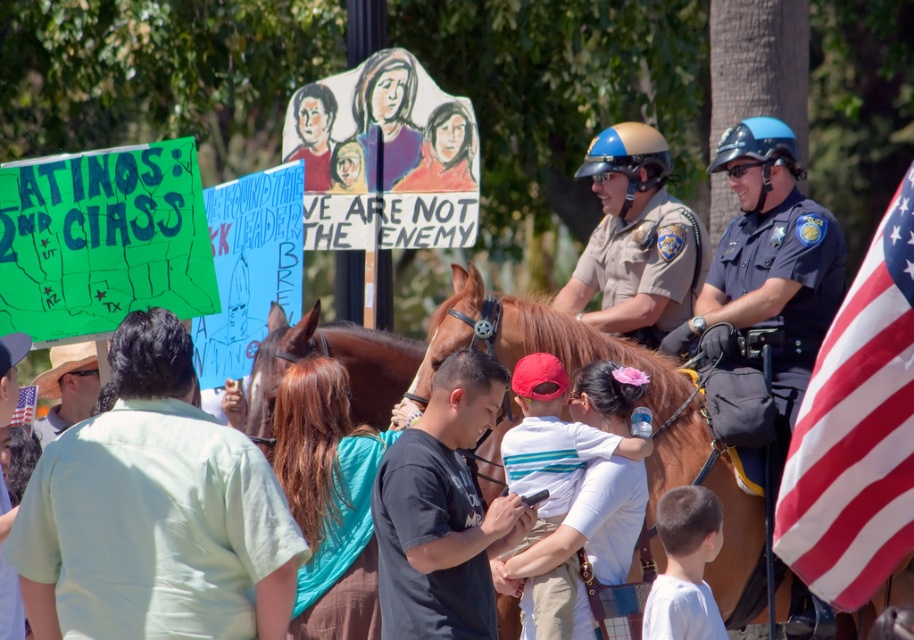
Question: Does light green fabric shirt at center-left lie behind shiny blue helmet at center?

Choices:
 (A) no
 (B) yes

Answer: (A)

Question: Does shiny blue helmet at center appear under brown glossy horse at center?

Choices:
 (A) no
 (B) yes

Answer: (A)

Question: Which object is positioned farthest from the dark gray t-shirt at center?

Choices:
 (A) brown leather horse at center
 (B) shiny blue helmet at center
 (C) red/white striped flag at right
 (D) striped cotton shirt at center

Answer: (C)

Question: Is the position of red/white striped flag at right more distant than that of brown leather horse at center?

Choices:
 (A) yes
 (B) no

Answer: (B)

Question: Estimate the real-world distances between objects in this image. Which object is closer to the light green fabric shirt at center-left?

Choices:
 (A) dark gray t-shirt at center
 (B) blue uniformed officer at right
 (C) striped cotton shirt at center
 (D) red/white striped flag at right

Answer: (A)

Question: Among these points, which one is farthest from the camera?

Choices:
 (A) (583, 506)
 (B) (73, 467)

Answer: (A)